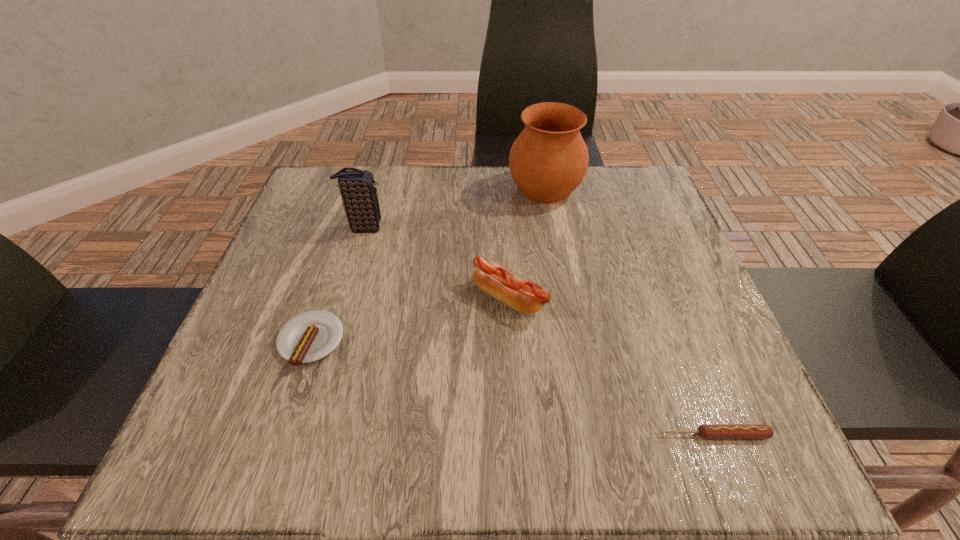
You are a GUI agent. You are given a task and a screenshot of the screen. Output one action in this format:
    pyautogui.click(x=<x>, y=<y>)
    Task: Click on the closest sausage relative to the fourth tallest object
    
    Given the screenshot: What is the action you would take?
    pyautogui.click(x=521, y=294)

The height and width of the screenshot is (540, 960). I want to click on sausage that is the second closest to the second farthest object, so click(x=521, y=294).